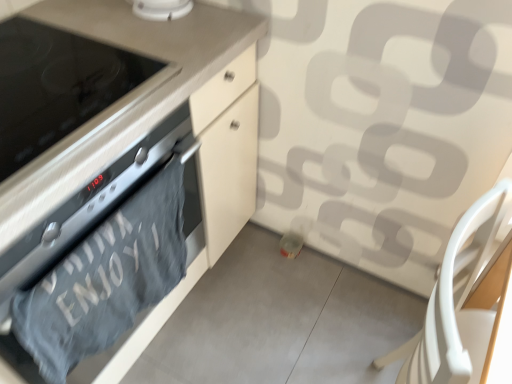
Question: Are white glossy smoke detector at upper center and black glass stove at left far apart?

Choices:
 (A) yes
 (B) no

Answer: (B)

Question: Does white glossy smoke detector at upper center turn towards black glass stove at left?

Choices:
 (A) no
 (B) yes

Answer: (A)

Question: Is white glossy smoke detector at upper center positioned before black glass stove at left?

Choices:
 (A) yes
 (B) no

Answer: (B)

Question: From a real-world perspective, does white glossy smoke detector at upper center sit lower than black glass stove at left?

Choices:
 (A) no
 (B) yes

Answer: (A)

Question: Is white glossy smoke detector at upper center bigger than black glass stove at left?

Choices:
 (A) yes
 (B) no

Answer: (B)

Question: Would you say black glass stove at left is part of white glossy smoke detector at upper center's contents?

Choices:
 (A) yes
 (B) no

Answer: (B)

Question: Is black glass stove at left positioned beyond the bounds of gray cotton towel at lower left?

Choices:
 (A) no
 (B) yes

Answer: (B)

Question: Does black glass stove at left have a greater height compared to gray cotton towel at lower left?

Choices:
 (A) yes
 (B) no

Answer: (B)

Question: Is black glass stove at left touching gray cotton towel at lower left?

Choices:
 (A) yes
 (B) no

Answer: (B)

Question: Is black glass stove at left shorter than gray cotton towel at lower left?

Choices:
 (A) yes
 (B) no

Answer: (A)

Question: Is gray cotton towel at lower left a part of black glass stove at left?

Choices:
 (A) no
 (B) yes

Answer: (A)

Question: Considering the relative sizes of black glass stove at left and gray cotton towel at lower left in the image provided, is black glass stove at left smaller than gray cotton towel at lower left?

Choices:
 (A) yes
 (B) no

Answer: (B)

Question: Is matte black oven at left smaller than gray cotton towel at lower left?

Choices:
 (A) yes
 (B) no

Answer: (B)